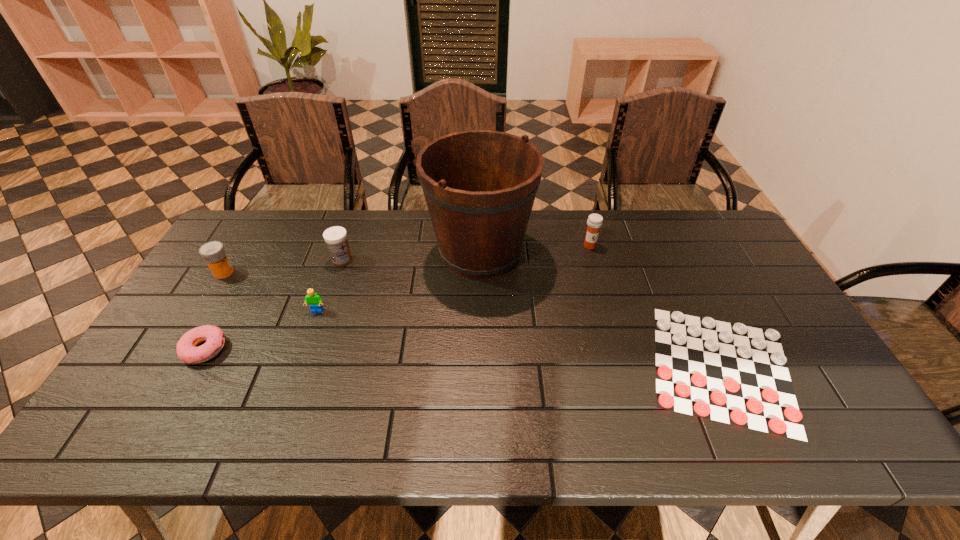
This screenshot has height=540, width=960. In order to click on doughnut located at the left edge in this screenshot , I will do `click(187, 351)`.

At what (x,y) coordinates should I click in order to perform the action: click on object present at the right edge. Please return your answer as a coordinate pair (x, y). This screenshot has width=960, height=540. Looking at the image, I should click on (731, 373).

Identify the location of object positioned at the near right corner. The image size is (960, 540). (731, 373).

Image resolution: width=960 pixels, height=540 pixels. I want to click on vacant area at the far edge, so click(288, 241).

Identify the location of vacant space at the near edge. (573, 448).

Locate an element on the screen. The height and width of the screenshot is (540, 960). blank area at the left edge is located at coordinates (239, 291).

Find the location of a particular element. vacant space at the right edge is located at coordinates (792, 337).

Identify the location of free region at the far left corner of the desktop. (266, 221).

Identify the location of free region at the far right corner of the desktop. The width and height of the screenshot is (960, 540). (708, 213).

The width and height of the screenshot is (960, 540). I want to click on vacant space at the near right corner, so click(x=837, y=427).